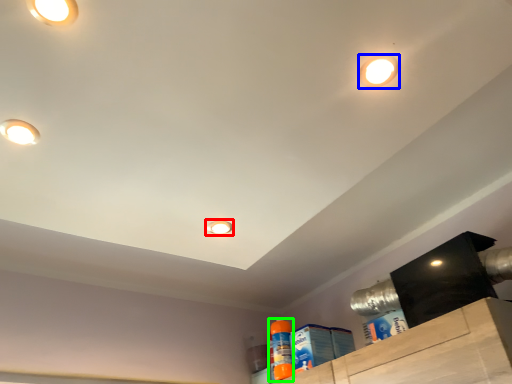
Question: Which object is the farthest from droplight (highlighted by a red box)? Choose among these: droplight (highlighted by a blue box) or cleaning product (highlighted by a green box).

Choices:
 (A) droplight
 (B) cleaning product

Answer: (B)